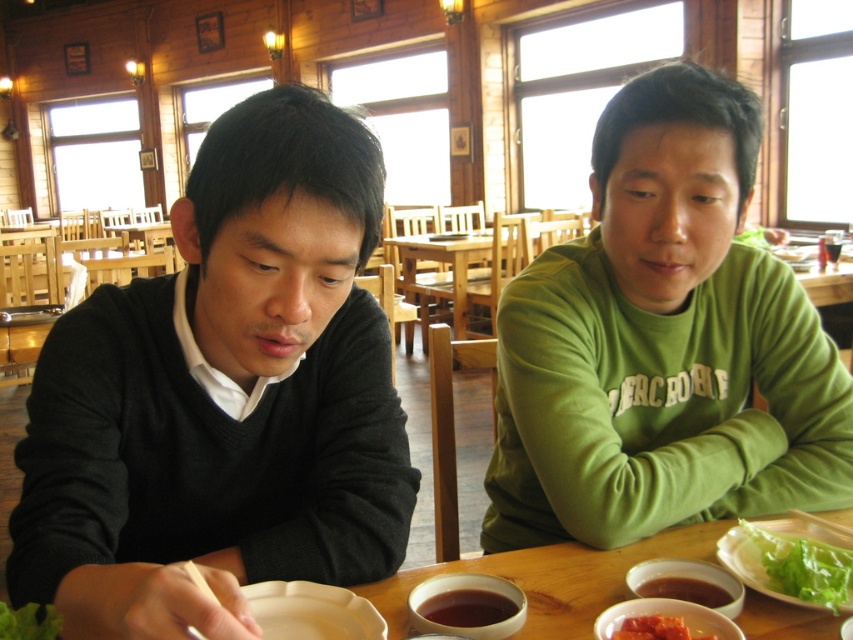
From the picture: You are standing at the entrance of the restaurant and see two people seated at a wooden table. The person on the left is wearing a dark gray sweater, and the person on the right is wearing a green long sleeved shirt. There is a point marked at coordinates (223, 396). Which person is this point closest to?

The point at (223, 396) corresponds to the dark gray sweater at left, so it is closest to the person on the left.

You are a server in a restaurant and need to place a tray of food between the two points labeled point (271, 620) and point (630, 634). Which point should the tray be closer to in order to avoid blocking the view of the window?

The tray should be placed closer to point (630, 634) because point (271, 620) is behind it, so placing the tray closer to the front point would avoid blocking the window view.

You are a server in a restaurant and need to place a new dish on the table. The dish requires a plate that is wider than the existing smooth tomato paste at lower center. Can you use the white matte plate at lower center for this purpose?

The white matte plate at lower center might be wider than smooth tomato paste at lower center, so it could potentially be suitable for placing the new dish, but there is uncertainty due to the comparative size mentioned.